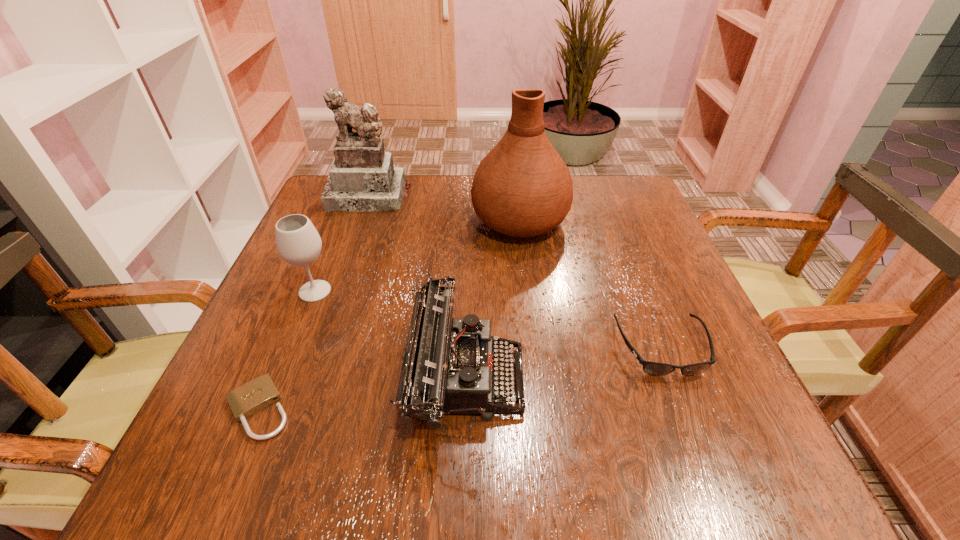
This screenshot has height=540, width=960. In order to click on object that is at the right edge in this screenshot , I will do `click(652, 368)`.

Identify the location of object that is at the far left corner. (362, 177).

Find the location of a particular element. The height and width of the screenshot is (540, 960). object located in the near left corner section of the desktop is located at coordinates point(254,396).

Identify the location of free space at the far edge. (425, 201).

This screenshot has height=540, width=960. In the image, there is a desktop. What are the coordinates of `free space at the left edge` in the screenshot? It's located at (345, 259).

This screenshot has width=960, height=540. Identify the location of vacant region at the right edge. (660, 404).

Where is `free region at the far left corner of the desktop`? Image resolution: width=960 pixels, height=540 pixels. free region at the far left corner of the desktop is located at coordinates (328, 224).

In the image, there is a desktop. Find the location of `free space at the near left corner`. free space at the near left corner is located at coordinates tap(263, 482).

The width and height of the screenshot is (960, 540). What are the coordinates of `vacant region at the far right corner of the desktop` in the screenshot? It's located at (590, 192).

Identify the location of vacant area that lies between the padlock and the fourth shortest object. (287, 350).